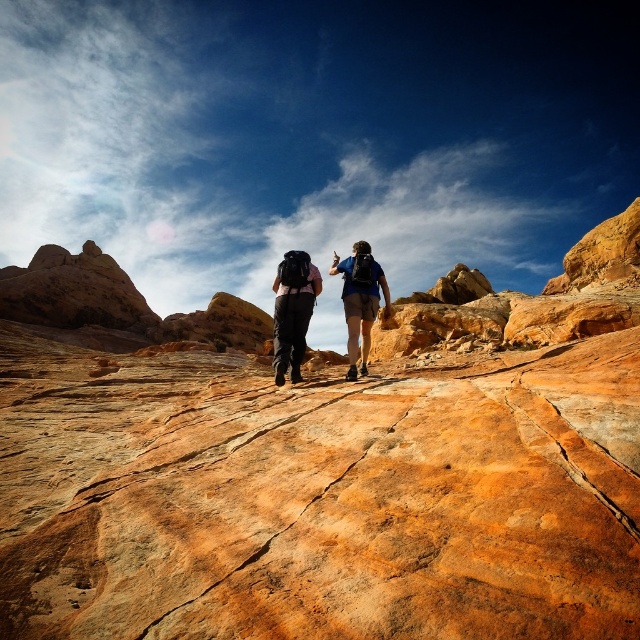
Consider the image. You are a drone operator trying to capture a photo of the matte black backpacks at center and the matte black backpack at center. The camera has a maximum focus range of 30 feet. Will both backpacks be in focus if you fly the drone to the same position as the hikers?

The distance between the matte black backpacks at center and the matte black backpack at center is 36.33 feet. Since the camera can only focus up to 30 feet, the backpacks will be out of focus.

You are a photographer trying to capture a photo of the two hikers with their backpacks. You want to ensure that the matte black backpacks at center and the matte blue backpack at center are both visible in the frame. Based on their positions, which backpack should you focus on first to include both in the photo?

The matte black backpacks at center is to the left of the matte blue backpack at center, so you should focus on the matte black backpacks at center first to ensure both are in the frame.